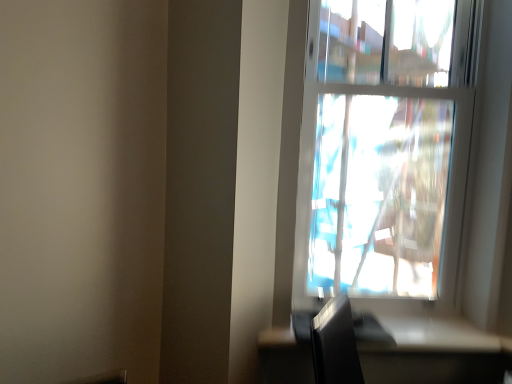
What are the coordinates of `free space above satin black table at lower right (from a real-world perspective)` in the screenshot? It's located at (391, 325).